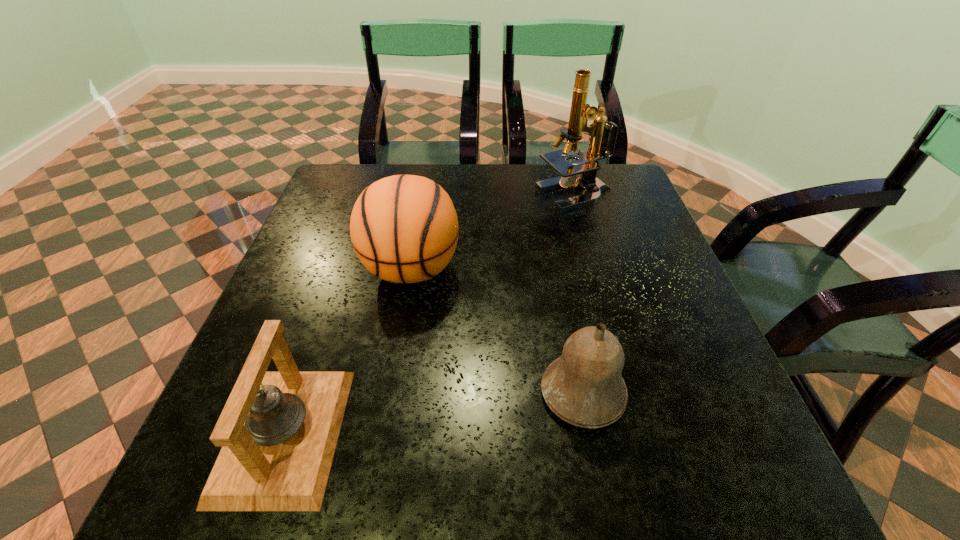
The width and height of the screenshot is (960, 540). I want to click on the tallest object, so click(591, 187).

Locate an element on the screen. the farthest object is located at coordinates (591, 187).

The height and width of the screenshot is (540, 960). Find the location of `the third shortest object`. the third shortest object is located at coordinates (404, 228).

At what (x,y) coordinates should I click in order to perform the action: click on basketball. Please return your answer as a coordinate pair (x, y). The width and height of the screenshot is (960, 540). Looking at the image, I should click on (404, 228).

Locate an element on the screen. the right bell is located at coordinates (584, 387).

Locate an element on the screen. Image resolution: width=960 pixels, height=540 pixels. the left bell is located at coordinates (278, 430).

The image size is (960, 540). Find the location of `vacant area situated at the eyepiece of the tallest object`. vacant area situated at the eyepiece of the tallest object is located at coordinates (444, 197).

Find the location of a particular element. vacant space situated at the eyepiece of the tallest object is located at coordinates (400, 197).

Locate an element on the screen. The width and height of the screenshot is (960, 540). vacant space situated at the eyepiece of the tallest object is located at coordinates (497, 197).

The width and height of the screenshot is (960, 540). What are the coordinates of `vacant region located on the front of the third shortest object` in the screenshot? It's located at (390, 392).